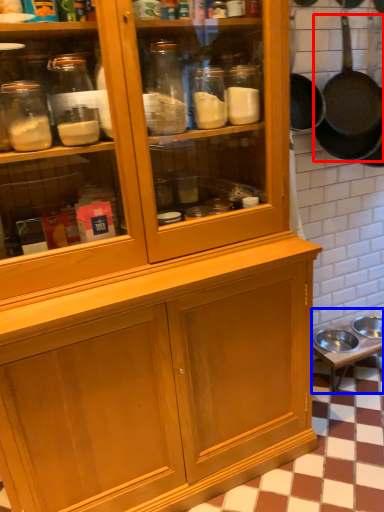
Question: Which of the following is the closest to the observer, frying pan (highlighted by a red box) or table (highlighted by a blue box)?

Choices:
 (A) frying pan
 (B) table

Answer: (A)